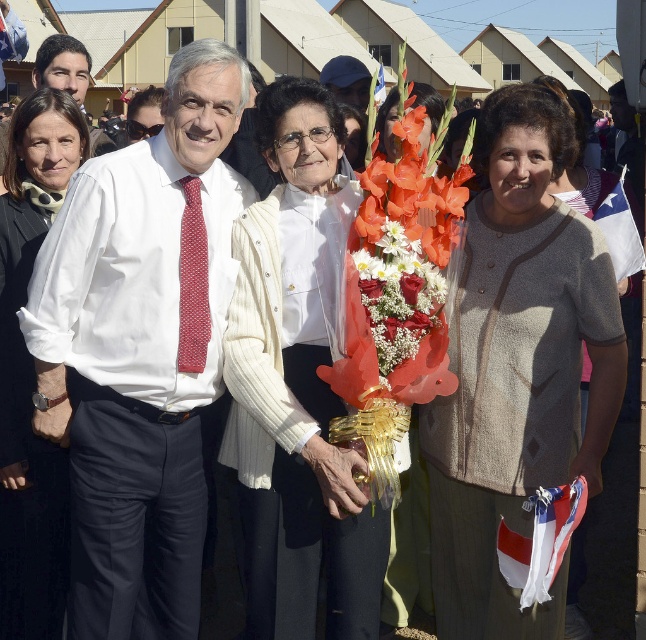
You are a photographer trying to capture a clear shot of both the white fabric shirt at upper left and the white fabric flag at lower right. Which object is positioned higher in the frame?

The white fabric shirt at upper left is located above the white fabric flag at lower right, so it is positioned higher in the frame.